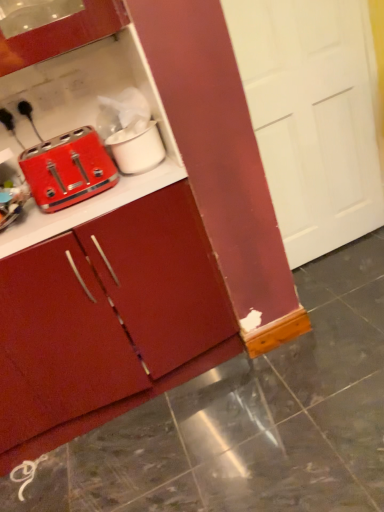
Question: Considering the relative positions of matte red toaster at left and matte red cabinet at center in the image provided, is matte red toaster at left to the right of matte red cabinet at center from the viewer's perspective?

Choices:
 (A) no
 (B) yes

Answer: (B)

Question: Considering the relative positions of matte red toaster at left and matte red cabinet at center in the image provided, is matte red toaster at left to the left of matte red cabinet at center from the viewer's perspective?

Choices:
 (A) no
 (B) yes

Answer: (A)

Question: Is matte red toaster at left surrounding matte red cabinet at center?

Choices:
 (A) no
 (B) yes

Answer: (A)

Question: Does matte red toaster at left touch matte red cabinet at center?

Choices:
 (A) yes
 (B) no

Answer: (B)

Question: From the image's perspective, is matte red toaster at left on matte red cabinet at center?

Choices:
 (A) yes
 (B) no

Answer: (A)

Question: In terms of width, does matte red cabinet at center look wider or thinner when compared to white glossy tile at lower left?

Choices:
 (A) thin
 (B) wide

Answer: (B)

Question: Is point (43, 444) closer or farther from the camera than point (21, 477)?

Choices:
 (A) farther
 (B) closer

Answer: (A)

Question: From a real-world perspective, is matte red cabinet at center physically located above or below white glossy tile at lower left?

Choices:
 (A) above
 (B) below

Answer: (A)

Question: Based on their sizes in the image, would you say matte red cabinet at center is bigger or smaller than white glossy tile at lower left?

Choices:
 (A) small
 (B) big

Answer: (B)

Question: From the image's perspective, is white matte pot at upper center positioned above or below matte red cabinet at center?

Choices:
 (A) below
 (B) above

Answer: (B)

Question: Looking at their shapes, would you say white matte pot at upper center is wider or thinner than matte red cabinet at center?

Choices:
 (A) wide
 (B) thin

Answer: (B)

Question: Considering the positions of white matte pot at upper center and matte red cabinet at center in the image, is white matte pot at upper center bigger or smaller than matte red cabinet at center?

Choices:
 (A) small
 (B) big

Answer: (A)

Question: Is white matte pot at upper center in front of or behind matte red cabinet at center in the image?

Choices:
 (A) front
 (B) behind

Answer: (B)

Question: Considering the positions of point (76, 139) and point (148, 164), is point (76, 139) closer or farther from the camera than point (148, 164)?

Choices:
 (A) farther
 (B) closer

Answer: (B)

Question: Based on their positions, is matte red toaster at left located to the left or right of white matte pot at upper center?

Choices:
 (A) right
 (B) left

Answer: (B)